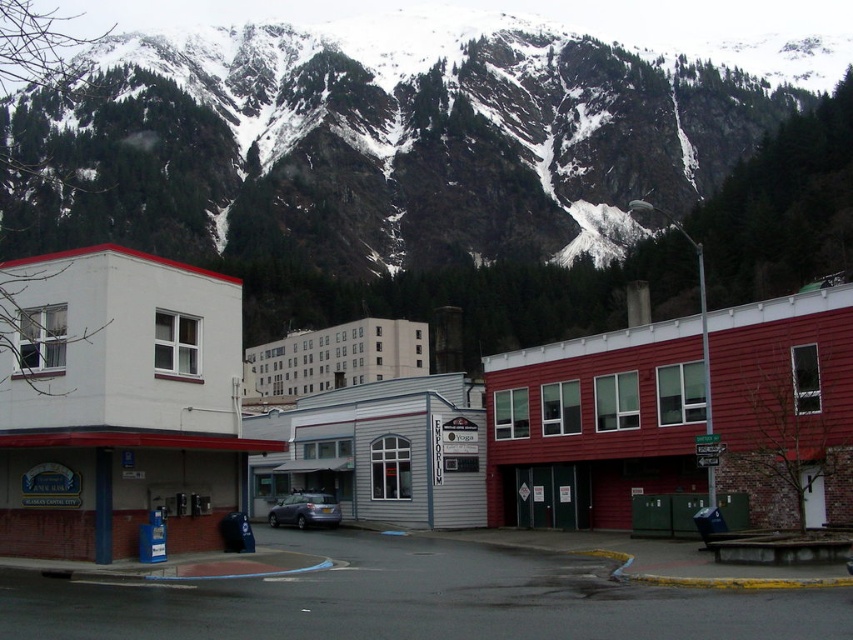
Based on the scene description, where is the snowy rock at upper center located in terms of coordinates?

The snowy rock at upper center is located at coordinates point (x=437, y=170).